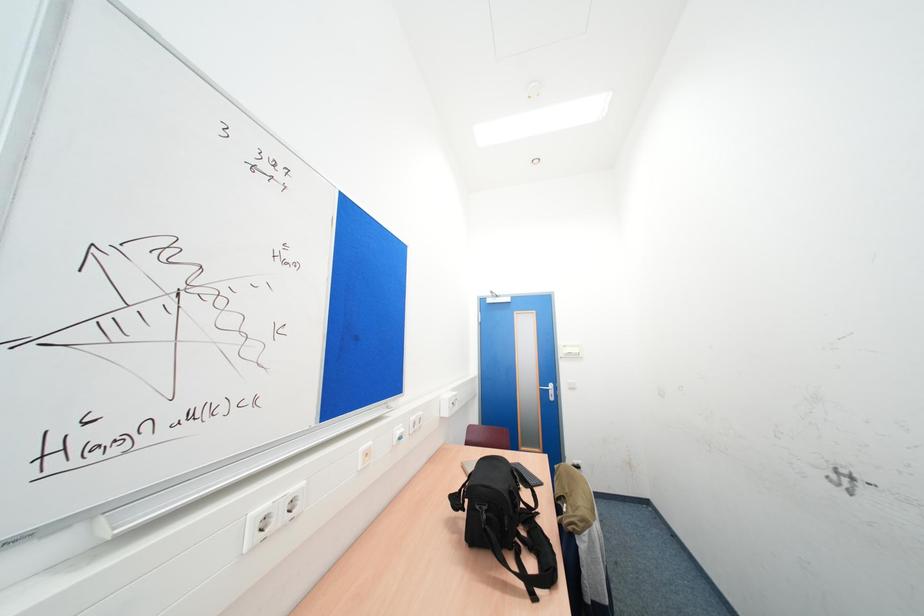
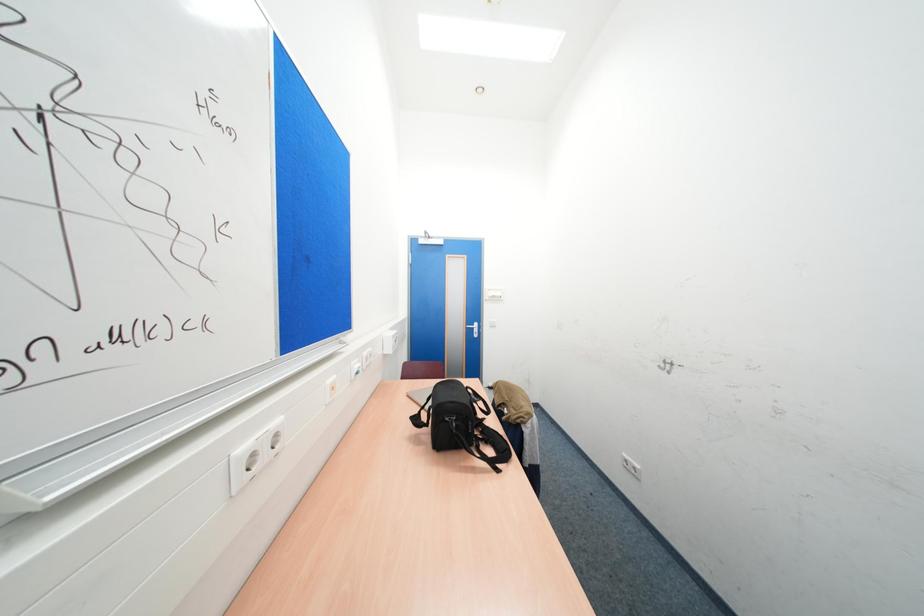
Question: The camera is either moving clockwise (left) or counter-clockwise (right) around the object. The first image is from the beginning of the video and the second image is from the end. Is the camera moving left or right when shooting the video?

Choices:
 (A) Left
 (B) Right

Answer: (A)